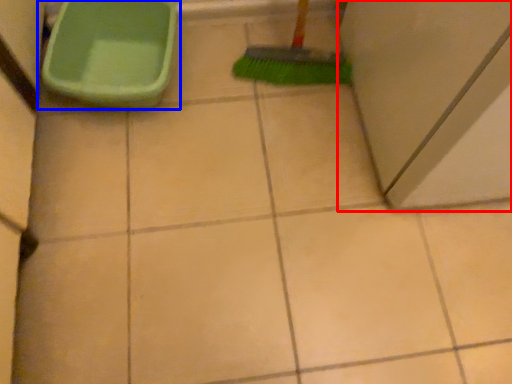
Question: Which point is closer to the camera, screen door (highlighted by a red box) or toilet (highlighted by a blue box)?

Choices:
 (A) screen door
 (B) toilet

Answer: (A)